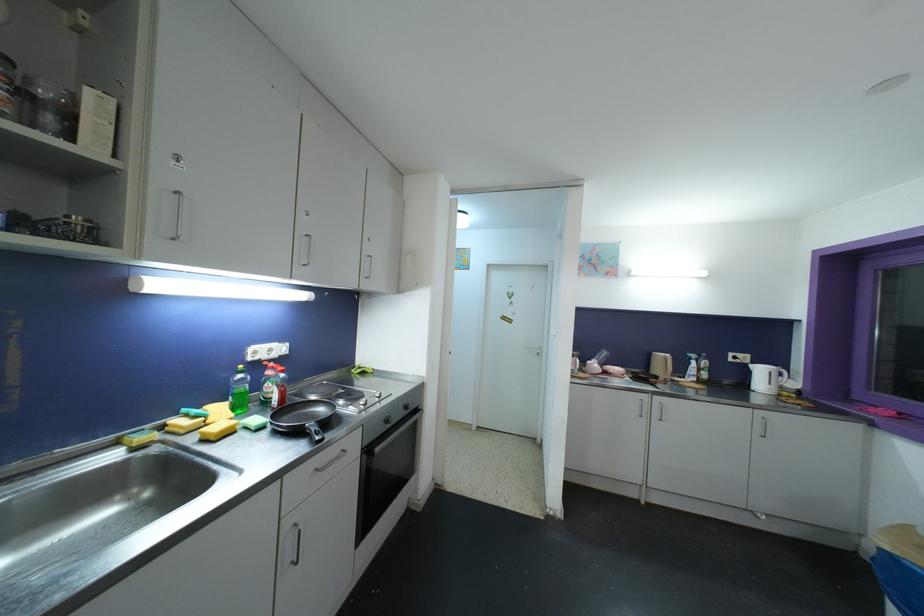
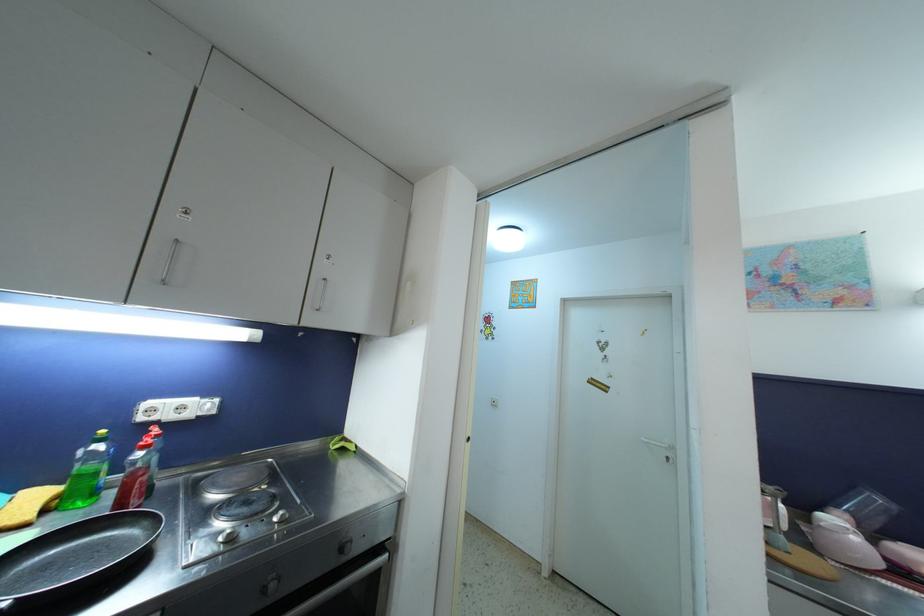
Question: The camera is either moving clockwise (left) or counter-clockwise (right) around the object. The first image is from the beginning of the video and the second image is from the end. Is the camera moving left or right when shooting the video?

Choices:
 (A) Left
 (B) Right

Answer: (B)